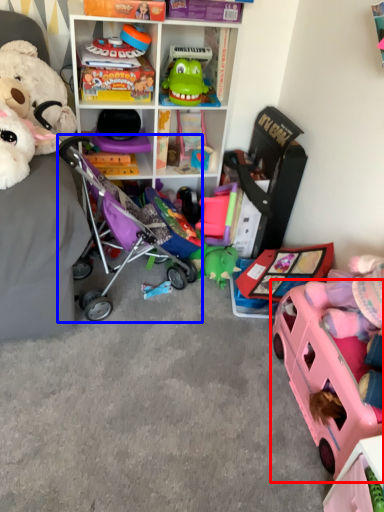
Question: Which of the following is the farthest to the observer, toy (highlighted by a red box) or baby carriage (highlighted by a blue box)?

Choices:
 (A) toy
 (B) baby carriage

Answer: (B)